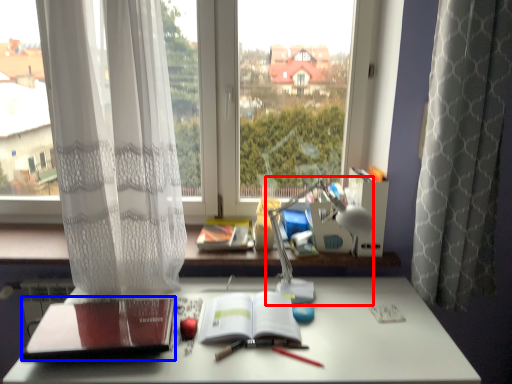
Question: Among these objects, which one is nearest to the camera, table lamp (highlighted by a red box) or paperback book (highlighted by a blue box)?

Choices:
 (A) table lamp
 (B) paperback book

Answer: (B)